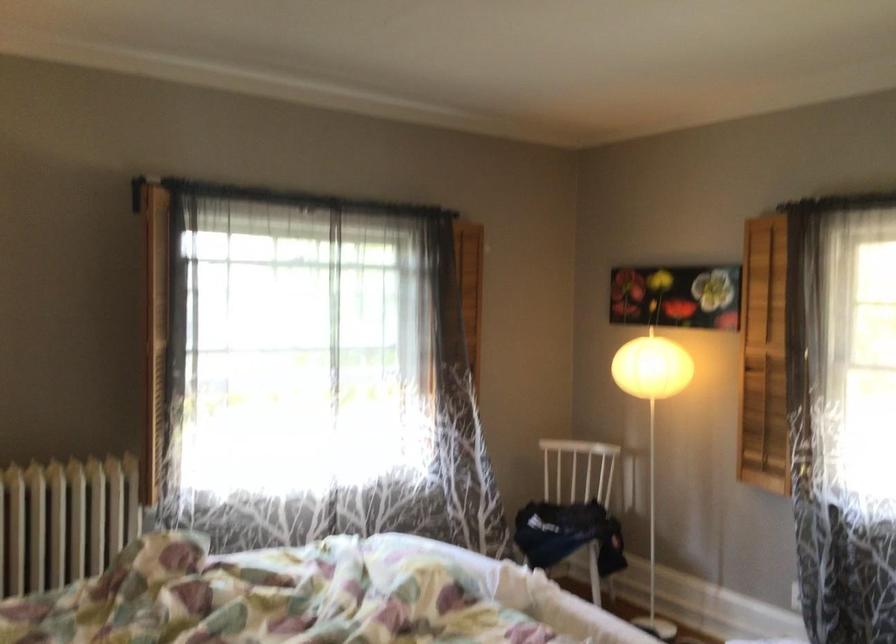
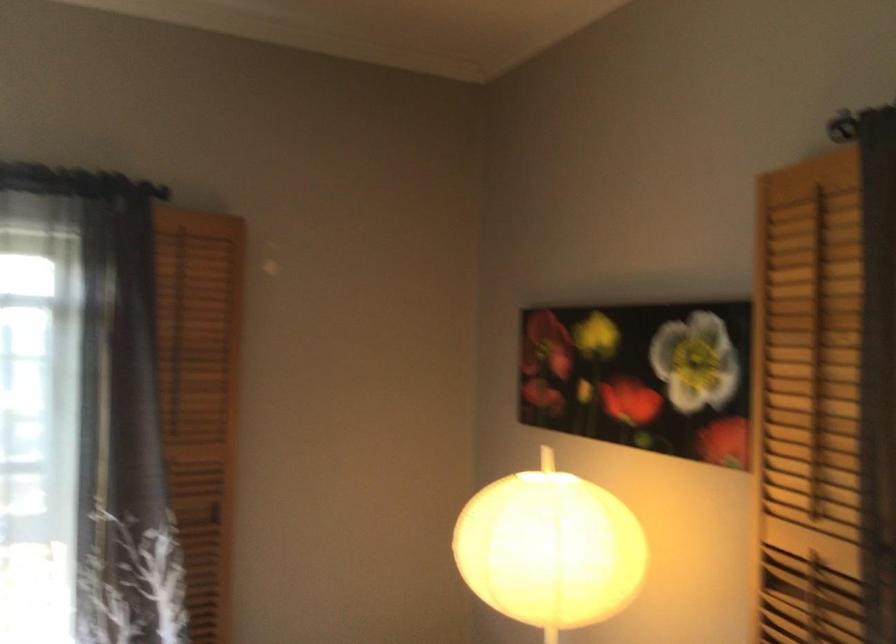
Where in the second image is the point corresponding to [450,344] from the first image?

(124, 487)